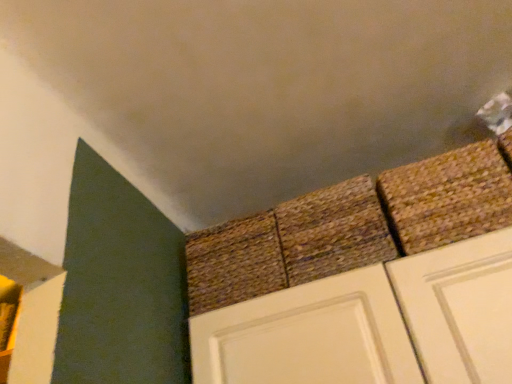
Describe the element at coordinates (333, 231) in the screenshot. I see `rustic woven mat at center, placed as the second brick when sorted from right to left` at that location.

In the scene shown: In order to face rustic woven mat at center, placed as the second brick when sorted from right to left, should I rotate leftwards or rightwards?

Turn right approximately 11.229 degrees to face it.

The height and width of the screenshot is (384, 512). Describe the element at coordinates (234, 263) in the screenshot. I see `brown woven mat at center, which ranks as the 1th brick in left-to-right order` at that location.

I want to click on rustic woven mat at center, placed as the second brick when sorted from right to left, so click(333, 231).

Who is smaller, brown woven rug at upper right, the first brick positioned from the right, or brown woven mat at center, marked as the third brick in a right-to-left arrangement?

brown woven rug at upper right, the first brick positioned from the right.

Locate an element on the screen. This screenshot has width=512, height=384. brick that is the 2nd one when counting backward from the brown woven rug at upper right, placed as the third brick when sorted from left to right is located at coordinates (234, 263).

Considering the relative positions of brown woven rug at upper right, the first brick positioned from the right, and brown woven mat at center, which ranks as the 1th brick in left-to-right order, in the image provided, is brown woven rug at upper right, the first brick positioned from the right, to the left or to the right of brown woven mat at center, which ranks as the 1th brick in left-to-right order,?

Based on their positions, brown woven rug at upper right, the first brick positioned from the right, is located to the right of brown woven mat at center, which ranks as the 1th brick in left-to-right order.

Is brown woven rug at upper right, placed as the third brick when sorted from left to right, facing away from brown woven mat at center, which ranks as the 1th brick in left-to-right order?

No, brown woven rug at upper right, placed as the third brick when sorted from left to right, is not facing away from brown woven mat at center, which ranks as the 1th brick in left-to-right order.

From the image's perspective, is rustic woven mat at center, the 2th brick in the left-to-right sequence, on brown woven mat at center, marked as the third brick in a right-to-left arrangement?

Yes, from the image's perspective, rustic woven mat at center, the 2th brick in the left-to-right sequence, is over brown woven mat at center, marked as the third brick in a right-to-left arrangement.

I want to click on brick below the rustic woven mat at center, placed as the second brick when sorted from right to left (from the image's perspective), so click(234, 263).

Does rustic woven mat at center, placed as the second brick when sorted from right to left, appear on the right side of brown woven mat at center, which ranks as the 1th brick in left-to-right order?

Correct, you'll find rustic woven mat at center, placed as the second brick when sorted from right to left, to the right of brown woven mat at center, which ranks as the 1th brick in left-to-right order.

Considering the relative sizes of brown woven mat at center, marked as the third brick in a right-to-left arrangement, and brown woven rug at upper right, placed as the third brick when sorted from left to right, in the image provided, is brown woven mat at center, marked as the third brick in a right-to-left arrangement, smaller than brown woven rug at upper right, placed as the third brick when sorted from left to right,?

No, brown woven mat at center, marked as the third brick in a right-to-left arrangement, is not smaller than brown woven rug at upper right, placed as the third brick when sorted from left to right.

Between brown woven mat at center, which ranks as the 1th brick in left-to-right order, and brown woven rug at upper right, the first brick positioned from the right, which one appears on the right side from the viewer's perspective?

Positioned to the right is brown woven rug at upper right, the first brick positioned from the right.

From a real-world perspective, is brown woven mat at center, marked as the third brick in a right-to-left arrangement, beneath brown woven rug at upper right, the first brick positioned from the right?

Incorrect, from a real-world perspective, brown woven mat at center, marked as the third brick in a right-to-left arrangement, is higher than brown woven rug at upper right, the first brick positioned from the right.

Is brown woven mat at center, which ranks as the 1th brick in left-to-right order, positioned with its back to brown woven rug at upper right, the first brick positioned from the right?

brown woven mat at center, which ranks as the 1th brick in left-to-right order, does not have its back to brown woven rug at upper right, the first brick positioned from the right.

From the image's perspective, which object appears higher, brown woven mat at center, which ranks as the 1th brick in left-to-right order, or rustic woven mat at center, the 2th brick in the left-to-right sequence?

rustic woven mat at center, the 2th brick in the left-to-right sequence, from the image's perspective.

From a real-world perspective, is brown woven mat at center, which ranks as the 1th brick in left-to-right order, physically below rustic woven mat at center, the 2th brick in the left-to-right sequence?

Indeed, from a real-world perspective, brown woven mat at center, which ranks as the 1th brick in left-to-right order, is positioned beneath rustic woven mat at center, the 2th brick in the left-to-right sequence.

Measure the distance from brown woven mat at center, which ranks as the 1th brick in left-to-right order, to rustic woven mat at center, the 2th brick in the left-to-right sequence.

A distance of 5.36 inches exists between brown woven mat at center, which ranks as the 1th brick in left-to-right order, and rustic woven mat at center, the 2th brick in the left-to-right sequence.

Between point (198, 238) and point (344, 186), which one is positioned in front?

The point (344, 186) is more forward.

Are rustic woven mat at center, the 2th brick in the left-to-right sequence, and brown woven rug at upper right, placed as the third brick when sorted from left to right, making contact?

No, rustic woven mat at center, the 2th brick in the left-to-right sequence, is not next to brown woven rug at upper right, placed as the third brick when sorted from left to right.

Locate an element on the screen. The width and height of the screenshot is (512, 384). brick that appears in front of the rustic woven mat at center, placed as the second brick when sorted from right to left is located at coordinates (448, 197).

Considering the relative positions of rustic woven mat at center, the 2th brick in the left-to-right sequence, and brown woven rug at upper right, the first brick positioned from the right, in the image provided, is rustic woven mat at center, the 2th brick in the left-to-right sequence, to the right of brown woven rug at upper right, the first brick positioned from the right, from the viewer's perspective?

Incorrect, rustic woven mat at center, the 2th brick in the left-to-right sequence, is not on the right side of brown woven rug at upper right, the first brick positioned from the right.

Can you tell me how much rustic woven mat at center, placed as the second brick when sorted from right to left, and brown woven rug at upper right, placed as the third brick when sorted from left to right, differ in facing direction?

The angle between the facing direction of rustic woven mat at center, placed as the second brick when sorted from right to left, and the facing direction of brown woven rug at upper right, placed as the third brick when sorted from left to right, is 4.24 degrees.

Considering the relative sizes of brown woven rug at upper right, the first brick positioned from the right, and rustic woven mat at center, placed as the second brick when sorted from right to left, in the image provided, is brown woven rug at upper right, the first brick positioned from the right, wider than rustic woven mat at center, placed as the second brick when sorted from right to left,?

No.

Which of these two, brown woven rug at upper right, placed as the third brick when sorted from left to right, or rustic woven mat at center, placed as the second brick when sorted from right to left, stands taller?

rustic woven mat at center, placed as the second brick when sorted from right to left, is taller.

Is brown woven rug at upper right, the first brick positioned from the right, positioned beyond the bounds of rustic woven mat at center, placed as the second brick when sorted from right to left?

Yes.

Is point (488, 202) positioned after point (292, 244)?

No.

Identify the location of brick below the brown woven mat at center, marked as the third brick in a right-to-left arrangement (from a real-world perspective). This screenshot has height=384, width=512. (448, 197).

In order to click on brick behind the rustic woven mat at center, placed as the second brick when sorted from right to left in this screenshot , I will do `click(234, 263)`.

Estimate the real-world distances between objects in this image. Which object is closer to rustic woven mat at center, placed as the second brick when sorted from right to left, brown woven rug at upper right, placed as the third brick when sorted from left to right, or brown woven mat at center, which ranks as the 1th brick in left-to-right order?

Among the two, brown woven mat at center, which ranks as the 1th brick in left-to-right order, is located nearer to rustic woven mat at center, placed as the second brick when sorted from right to left.

Estimate the real-world distances between objects in this image. Which object is further from brown woven mat at center, marked as the third brick in a right-to-left arrangement, rustic woven mat at center, the 2th brick in the left-to-right sequence, or brown woven rug at upper right, placed as the third brick when sorted from left to right?

brown woven rug at upper right, placed as the third brick when sorted from left to right, lies further to brown woven mat at center, marked as the third brick in a right-to-left arrangement, than the other object.

Consider the image. From the image, which object appears to be farther from brown woven rug at upper right, placed as the third brick when sorted from left to right, rustic woven mat at center, the 2th brick in the left-to-right sequence, or brown woven mat at center, marked as the third brick in a right-to-left arrangement?

brown woven mat at center, marked as the third brick in a right-to-left arrangement, is positioned further to the anchor brown woven rug at upper right, placed as the third brick when sorted from left to right.

Estimate the real-world distances between objects in this image. Which object is further from rustic woven mat at center, placed as the second brick when sorted from right to left, brown woven mat at center, marked as the third brick in a right-to-left arrangement, or brown woven rug at upper right, placed as the third brick when sorted from left to right?

brown woven rug at upper right, placed as the third brick when sorted from left to right.

Based on their spatial positions, is brown woven mat at center, marked as the third brick in a right-to-left arrangement, or rustic woven mat at center, the 2th brick in the left-to-right sequence, further from brown woven rug at upper right, the first brick positioned from the right?

brown woven mat at center, marked as the third brick in a right-to-left arrangement, is further to brown woven rug at upper right, the first brick positioned from the right.

Estimate the real-world distances between objects in this image. Which object is closer to brown woven mat at center, marked as the third brick in a right-to-left arrangement, brown woven rug at upper right, the first brick positioned from the right, or rustic woven mat at center, the 2th brick in the left-to-right sequence?

Among the two, rustic woven mat at center, the 2th brick in the left-to-right sequence, is located nearer to brown woven mat at center, marked as the third brick in a right-to-left arrangement.

This screenshot has height=384, width=512. Identify the location of brick located between brown woven mat at center, which ranks as the 1th brick in left-to-right order, and brown woven rug at upper right, placed as the third brick when sorted from left to right, in the left-right direction. (333, 231).